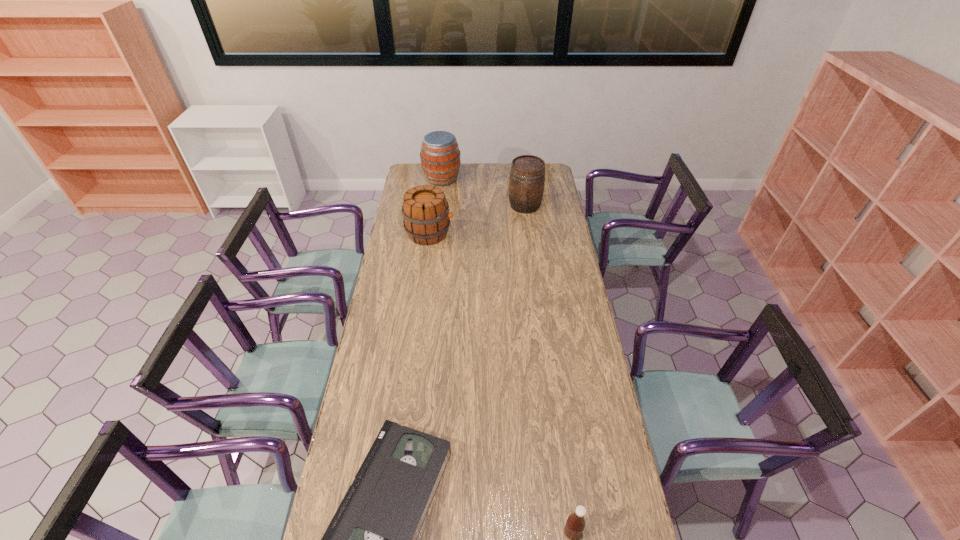
Where is `the farthest cider`? This screenshot has width=960, height=540. the farthest cider is located at coordinates (440, 156).

Image resolution: width=960 pixels, height=540 pixels. I want to click on the rightmost cider, so click(x=527, y=174).

Find the location of `the fourth nearest object`. the fourth nearest object is located at coordinates (527, 174).

The height and width of the screenshot is (540, 960). I want to click on the third farthest object, so click(x=426, y=214).

Where is `vacant position located 0.280m on the right of the farthest cider`? This screenshot has width=960, height=540. vacant position located 0.280m on the right of the farthest cider is located at coordinates (507, 178).

Locate an element on the screen. free spot located on the side of the second farthest cider near the bung hole is located at coordinates (531, 251).

You are a GUI agent. You are given a task and a screenshot of the screen. Output one action in this format:
    pyautogui.click(x=<x>, y=<y>)
    Task: Click on the vacant space situated 0.070m on the side of the third nearest object where the spigot is located
    The width and height of the screenshot is (960, 540).
    Given the screenshot: What is the action you would take?
    pyautogui.click(x=467, y=233)

The image size is (960, 540). In order to click on object at the far edge in this screenshot , I will do `click(440, 156)`.

Locate an element on the screen. Image resolution: width=960 pixels, height=540 pixels. object present at the right edge is located at coordinates (527, 174).

At what (x,y) coordinates should I click in order to perform the action: click on object that is at the far left corner. Please return your answer as a coordinate pair (x, y). Looking at the image, I should click on (440, 156).